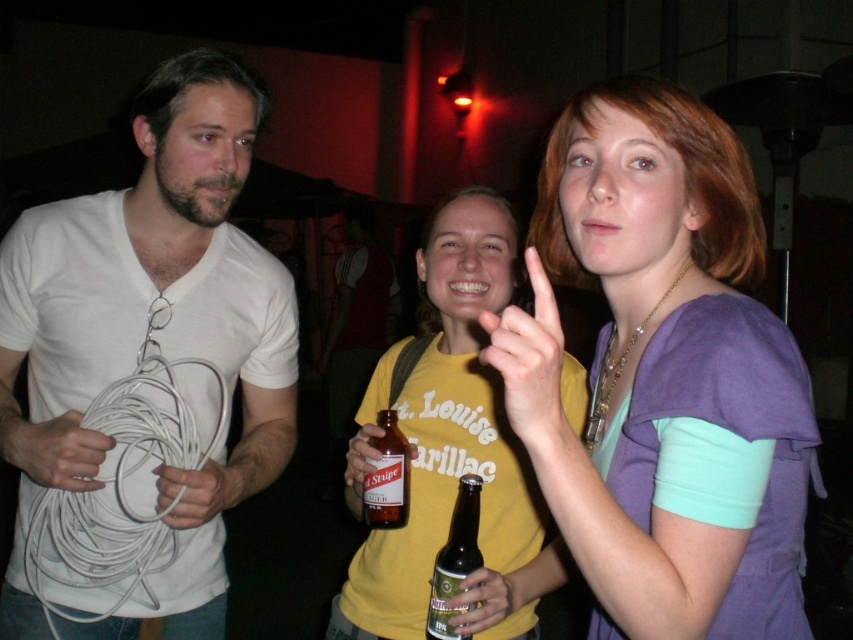
Between white matte cable at left and purple fabric shirt at upper right, which one appears on the right side from the viewer's perspective?

purple fabric shirt at upper right

Does point (115, 572) come closer to viewer compared to point (553, 259)?

No, it is behind (553, 259).

Image resolution: width=853 pixels, height=640 pixels. Identify the location of white matte cable at left. (148, 364).

Can you confirm if purple fabric shirt at upper right is taller than yellow cotton t-shirt at center?

In fact, purple fabric shirt at upper right may be shorter than yellow cotton t-shirt at center.

Which is in front, point (624, 324) or point (419, 348)?

Point (624, 324) is more forward.

I want to click on purple fabric shirt at upper right, so click(x=659, y=365).

What do you see at coordinates (659, 365) in the screenshot? I see `purple fabric shirt at upper right` at bounding box center [659, 365].

Which is in front, point (701, 397) or point (73, 419)?

Positioned in front is point (701, 397).

Does point (614, 88) lie in front of point (10, 438)?

Yes.

In order to click on purple fabric shirt at upper right in this screenshot , I will do `click(659, 365)`.